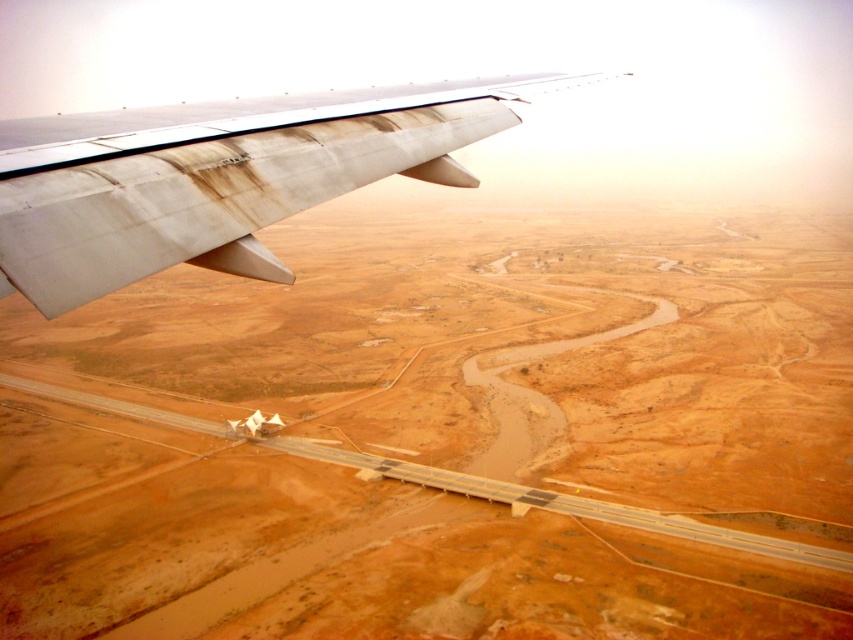
Is desert sand at upper left smaller than rusty aluminum wing at upper left?

Incorrect, desert sand at upper left is not smaller in size than rusty aluminum wing at upper left.

Which is behind, point (277, 593) or point (68, 157)?

The point (277, 593) is more distant.

You are a GUI agent. You are given a task and a screenshot of the screen. Output one action in this format:
    pyautogui.click(x=<x>, y=<y>)
    Task: Click on the desert sand at upper left
    Image resolution: width=853 pixels, height=640 pixels.
    Given the screenshot: What is the action you would take?
    pyautogui.click(x=515, y=349)